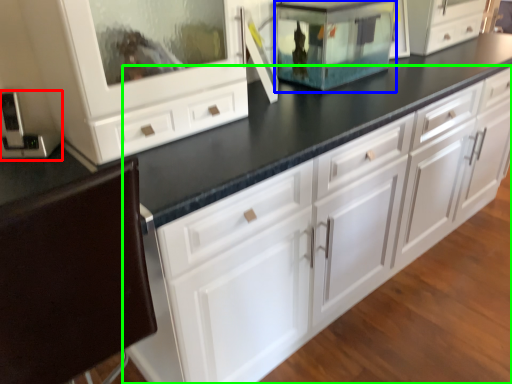
Question: Which is farther away from appliance (highlighted by a red box)? appliance (highlighted by a blue box) or chest of drawers (highlighted by a green box)?

Choices:
 (A) appliance
 (B) chest of drawers

Answer: (A)